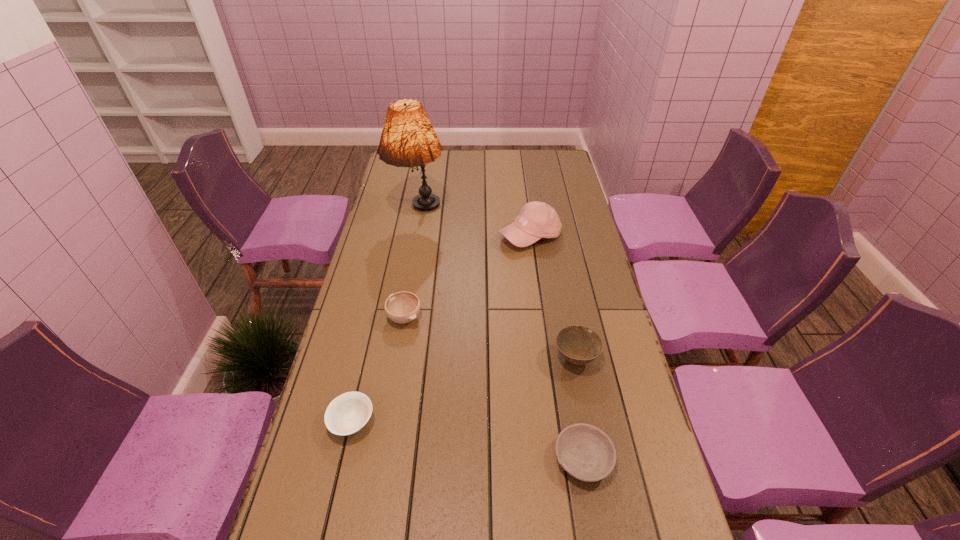
You are a GUI agent. You are given a task and a screenshot of the screen. Output one action in this format:
    pyautogui.click(x=<x>, y=<y>)
    Task: Click on the object identified as the closest to the second farthest bowl
    
    Given the screenshot: What is the action you would take?
    pyautogui.click(x=586, y=452)

Find the location of `object identified as the closest to the shortest object`. object identified as the closest to the shortest object is located at coordinates (579, 345).

This screenshot has width=960, height=540. Identify the location of bowl that is the second closest to the shortest bowl. (347, 414).

Find the location of a particular element. the closest bowl to the second farthest bowl is located at coordinates pyautogui.click(x=586, y=452).

The height and width of the screenshot is (540, 960). What are the coordinates of `free location that satisfies the following two spatial constraints: 1. on the front-facing side of the shortest bowl; 2. on the left side of the tallest object` in the screenshot? It's located at (375, 459).